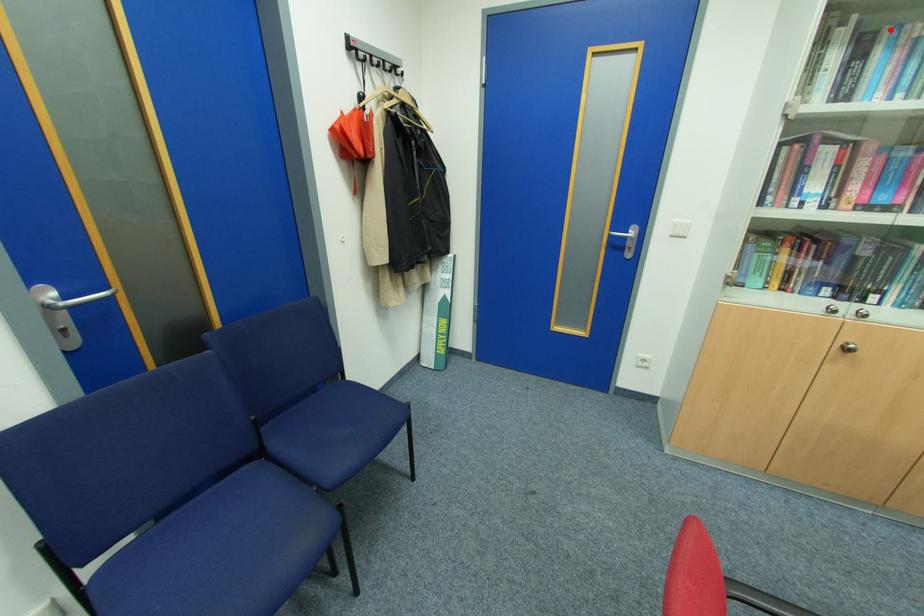
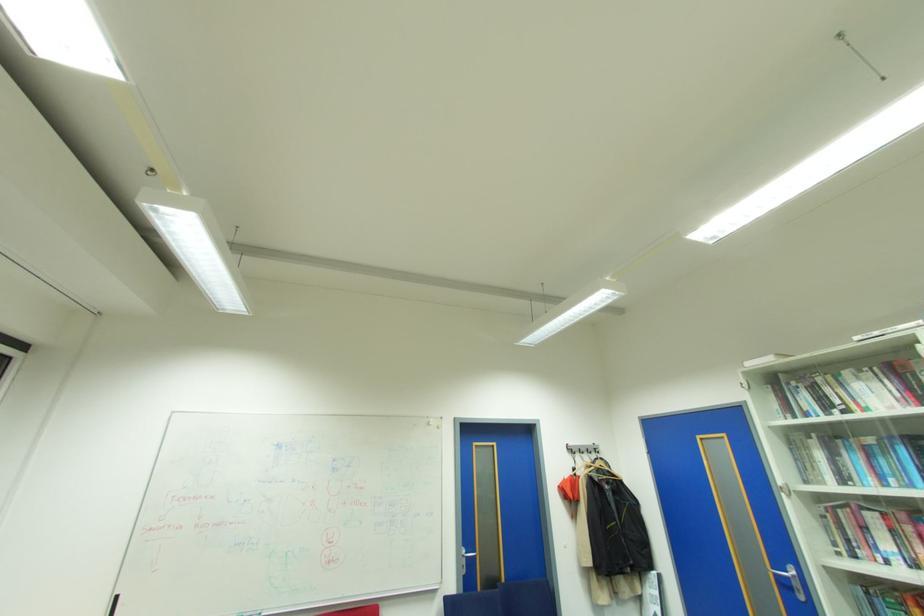
Question: I am providing you with two images of the same scene from different viewpoints. Image1 has a red point marked. In image2, the corresponding 3D location appears at what relative position? Reply with the corresponding letter.

Choices:
 (A) Closer
 (B) Farther

Answer: (A)